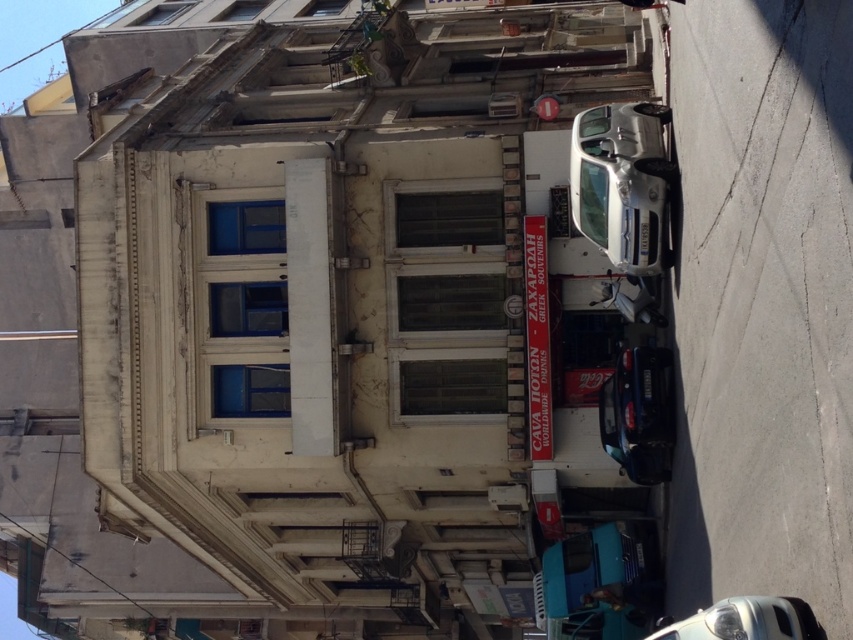
Measure the distance between point (611, 605) and camera.

Point (611, 605) is 174.66 feet from camera.

Does teal matte van at lower center come behind silver metallic car at lower right?

Yes, it is.

You are a GUI agent. You are given a task and a screenshot of the screen. Output one action in this format:
    pyautogui.click(x=<x>, y=<y>)
    Task: Click on the teal matte van at lower center
    This screenshot has width=853, height=640.
    Given the screenshot: What is the action you would take?
    pyautogui.click(x=601, y=582)

This screenshot has width=853, height=640. What are the coordinates of `shiny blue car at center` in the screenshot? It's located at (639, 413).

Is point (648, 420) in front of point (798, 609)?

No.

Is point (642, 428) behind point (767, 611)?

That is True.

Where is `shiny blue car at center`? The height and width of the screenshot is (640, 853). shiny blue car at center is located at coordinates (639, 413).

Who is shorter, silver metallic car at right or silver metallic car at lower right?

Standing shorter between the two is silver metallic car at lower right.

Can you confirm if silver metallic car at right is bigger than silver metallic car at lower right?

No.

Between point (624, 243) and point (815, 628), which one is positioned behind?

The point (624, 243) is behind.

The image size is (853, 640). What are the coordinates of `silver metallic car at right` in the screenshot? It's located at (622, 182).